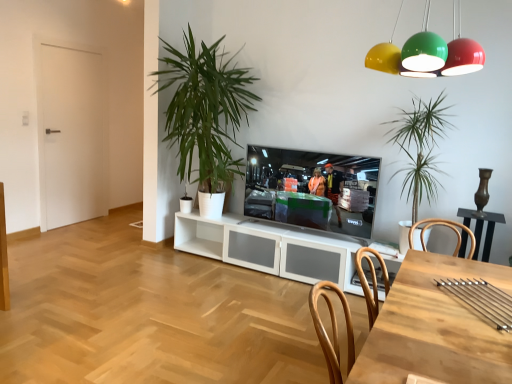
Identify the location of free spot below green leafy plant at center, the second houseplant when ordered from right to left (from a real-world perspective). This screenshot has width=512, height=384. (195, 265).